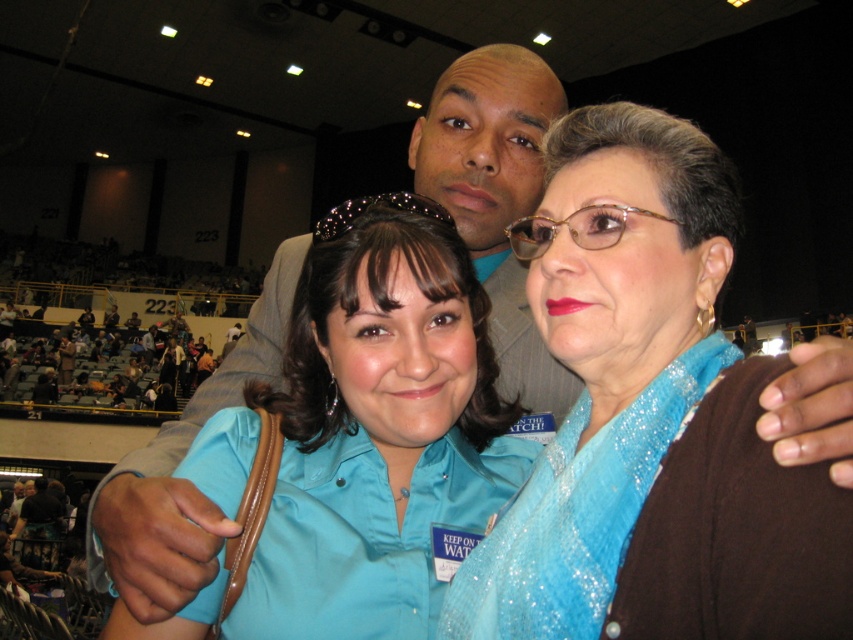
You are a photographer trying to capture a closeup of the sparkly blue scarf at center and the matte blue shirt at center. Which one will require you to zoom in more to fill the frame?

The sparkly blue scarf at center has a smaller width than the matte blue shirt at center, so you will need to zoom in more to capture the sparkly blue scarf at center to fill the frame.

You are standing at the point with coordinates point (428, 308) and want to move towards the point with coordinates point (718, 497). Which direction should you move in to reach your destination?

To reach point (718, 497) from point (428, 308), you should move forward since point (718, 497) is in front of point (428, 308).

You are at a large indoor event and see two blue items at the center of the image. The sparkly blue scarf at center and the matte blue shirt at center. Which one is positioned to the right side?

The sparkly blue scarf at center is positioned to the right of the matte blue shirt at center.